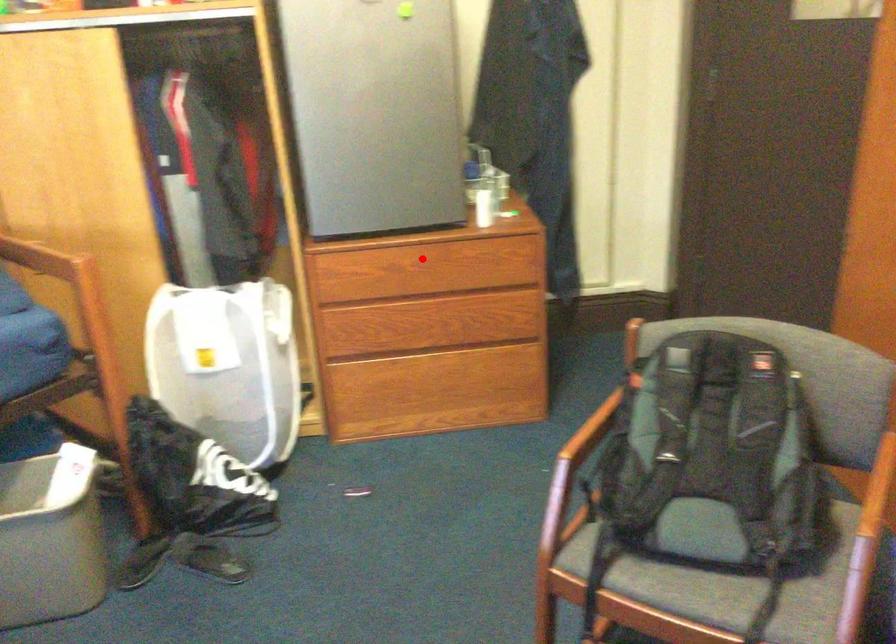
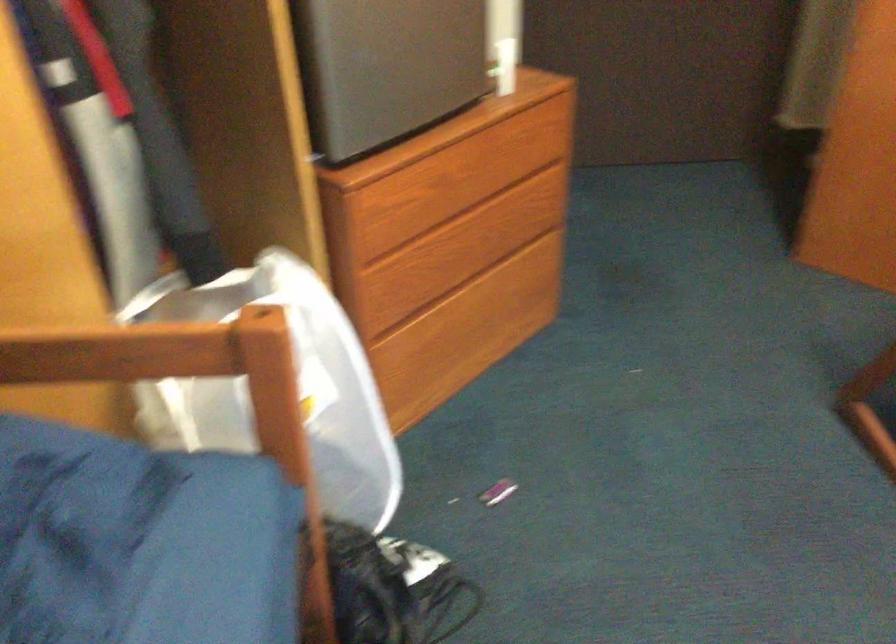
Question: A red point is marked in image1. In image2, is the corresponding 3D point closer to the camera or farther? Reply with the corresponding letter.

Choices:
 (A) The corresponding 3D point is closer.
 (B) The corresponding 3D point is farther.

Answer: (A)